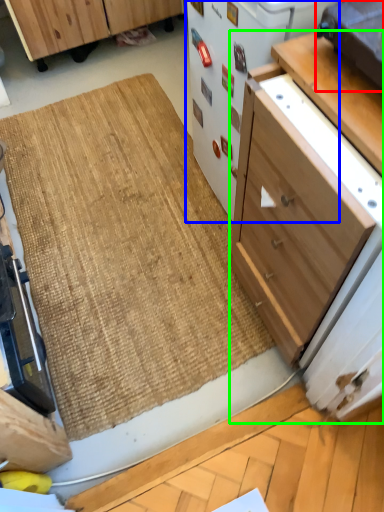
Question: Considering the real-world distances, which object is closest to appliance (highlighted by a red box)? appliance (highlighted by a blue box) or cabinetry (highlighted by a green box).

Choices:
 (A) appliance
 (B) cabinetry

Answer: (B)